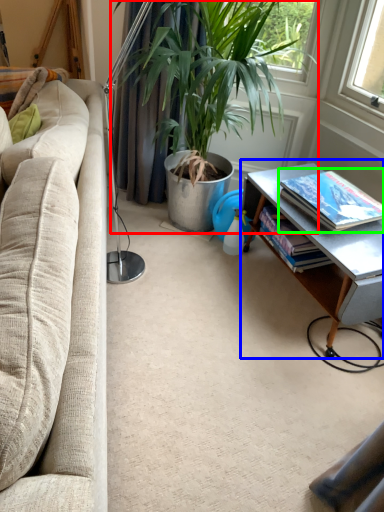
Question: Based on their relative distances, which object is nearer to houseplant (highlighted by a red box)? Choose from table (highlighted by a blue box) and book (highlighted by a green box).

Choices:
 (A) table
 (B) book

Answer: (A)